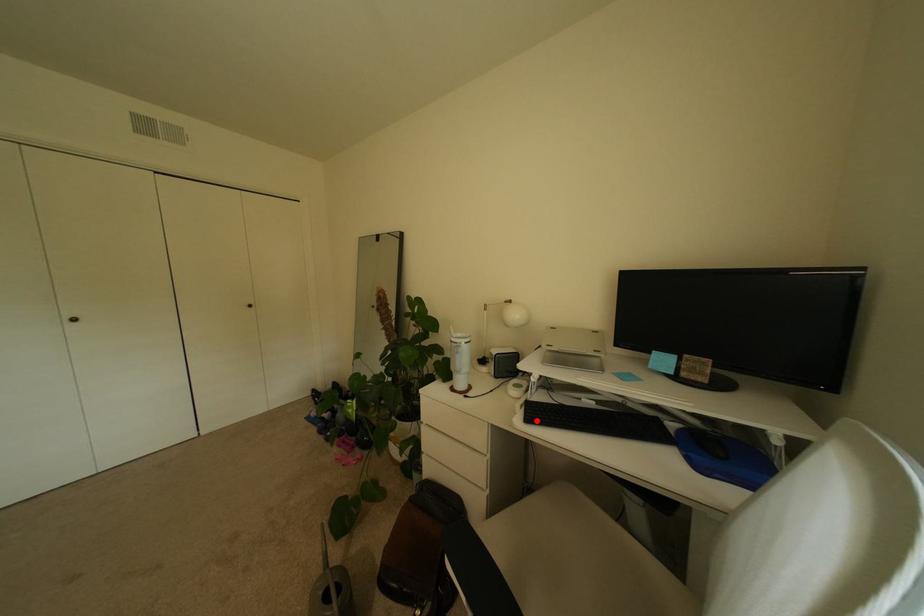
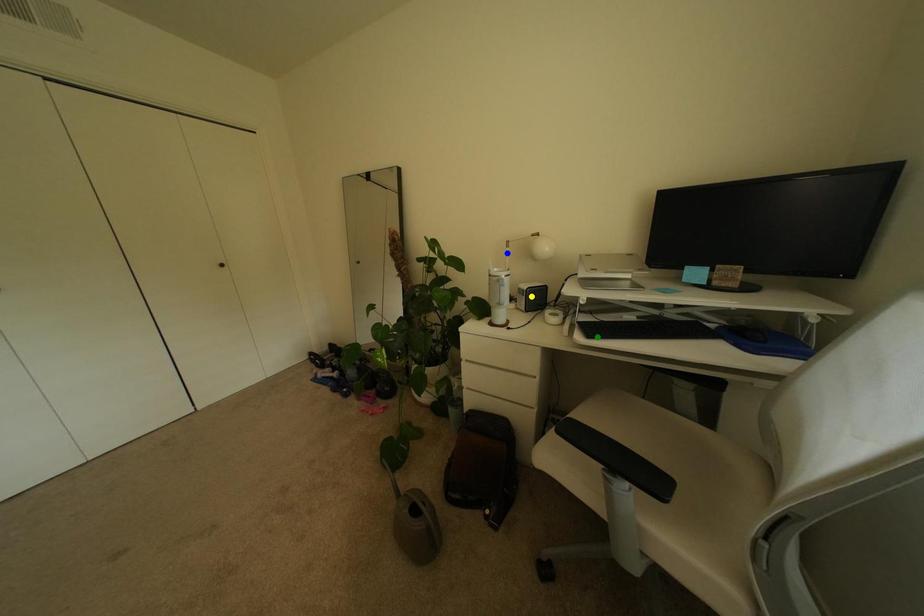
Question: I am providing you with two images of the same scene from different viewpoints. A red point is marked on the first image. You are given multiple points on the second image. Which spot in image 2 lines up with the point in image 1?

Choices:
 (A) blue point
 (B) yellow point
 (C) green point

Answer: (C)